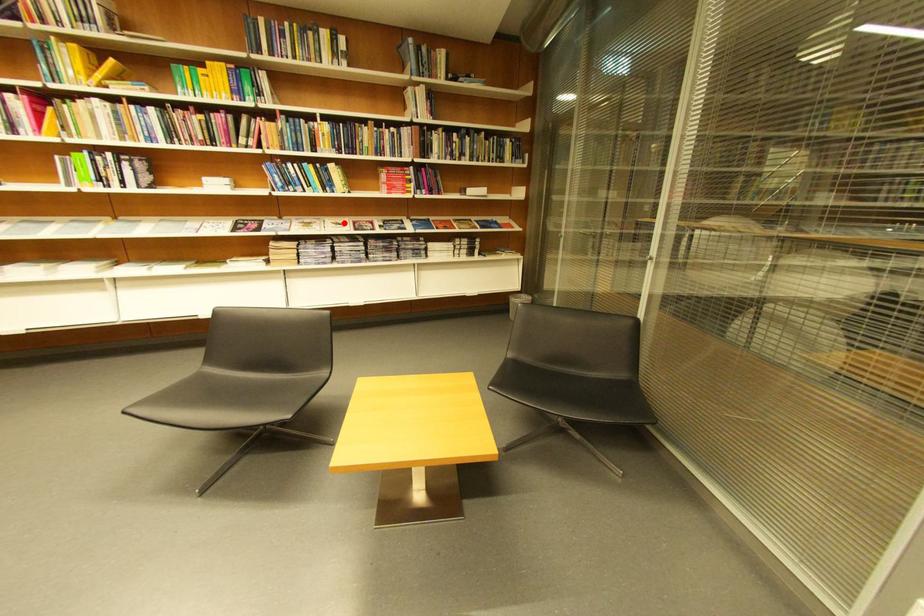
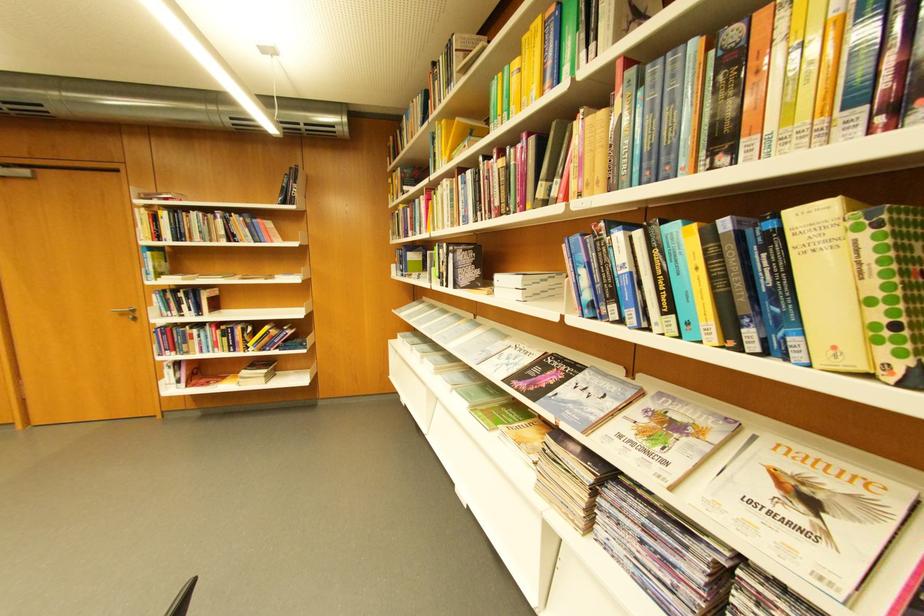
Question: A red point is marked in image1. In image2, is the corresponding 3D point closer to the camera or farther? Reply with the corresponding letter.

Choices:
 (A) The corresponding 3D point is closer.
 (B) The corresponding 3D point is farther.

Answer: (B)